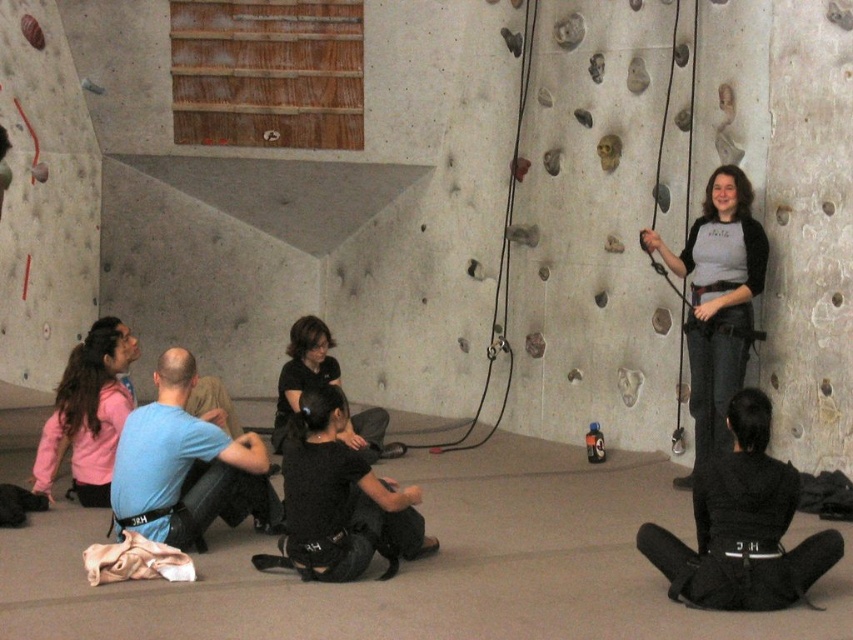
Question: Does blue fabric shirt at center have a lesser width compared to gray matte shirt at upper right?

Choices:
 (A) no
 (B) yes

Answer: (A)

Question: Is black fabric squat at lower right behind blue fabric shirt at center?

Choices:
 (A) yes
 (B) no

Answer: (B)

Question: Among these objects, which one is farthest from the camera?

Choices:
 (A) pink fleece jacket at lower left
 (B) black matte squat at center
 (C) blue fabric shirt at center
 (D) gray matte shirt at upper right

Answer: (D)

Question: Which point appears farthest from the camera in this image?

Choices:
 (A) (183, 492)
 (B) (712, 502)

Answer: (A)

Question: Estimate the real-world distances between objects in this image. Which object is closer to the gray matte shirt at upper right?

Choices:
 (A) black matte squat at center
 (B) black fabric squat at lower right
 (C) pink fleece jacket at lower left

Answer: (B)

Question: Does blue fabric shirt at center appear over pink fleece jacket at lower left?

Choices:
 (A) yes
 (B) no

Answer: (B)